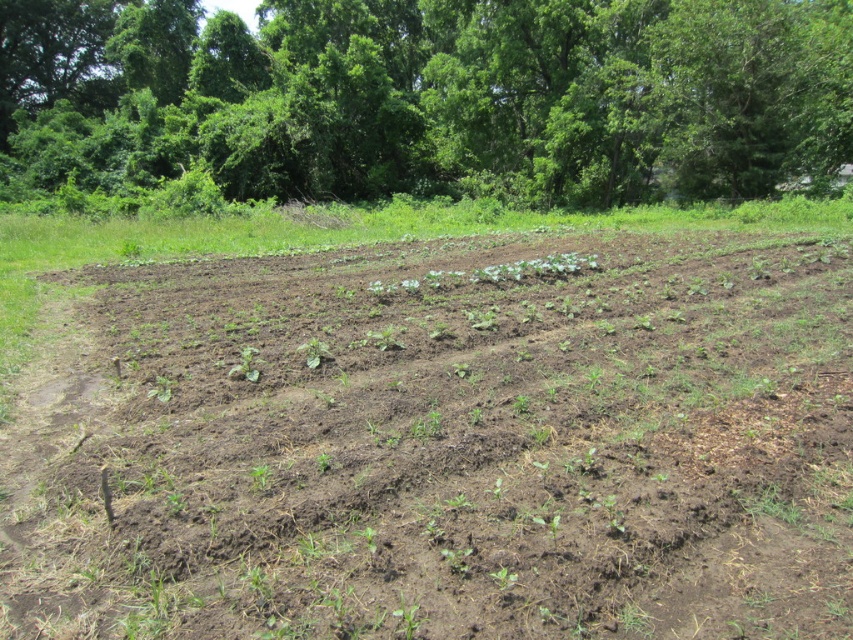
You are a farmer planning to install a small irrigation system between the brown soil at center and the green leafy trees at upper center. The system requires a minimum of 30 meters of space to function properly. Based on the scene, can the irrigation system be placed between these two areas?

The brown soil at center and green leafy trees at upper center are 34.13 meters apart, which is more than the required 30 meters. Therefore, the irrigation system can be placed between them.

You are a farmer checking the field. You notice a point marked at coordinates (445, 445). What is the condition of the soil at that point?

The point at coordinates (445, 445) is on brown soil at center, which is dark brown and rich, indicating recent tilling or plowing.